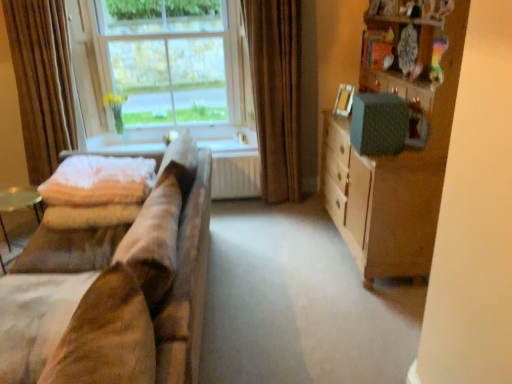
Find the location of a particular element. This screenshot has height=384, width=512. vacant area that lies between wooden cabinet at right and brown velvet curtain at center, which ranks as the 1th curtain in right-to-left order is located at coordinates (305, 235).